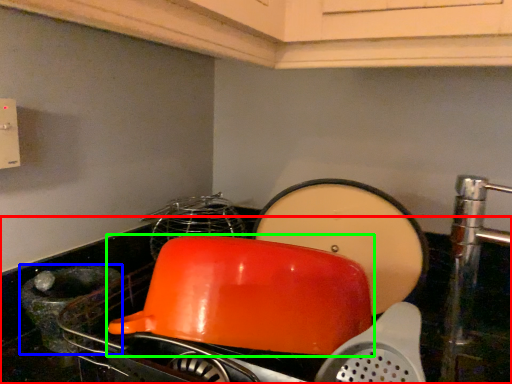
Question: Which object is positioned closest to counter top (highlighted by a red box)? Select from appliance (highlighted by a blue box) and kitchen appliance (highlighted by a green box).

Choices:
 (A) appliance
 (B) kitchen appliance

Answer: (A)